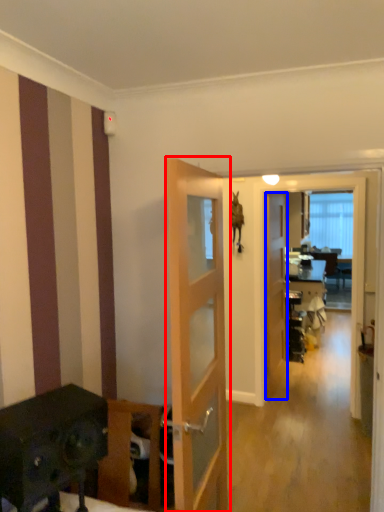
Question: Which object appears closest to the camera in this image, door (highlighted by a red box) or door (highlighted by a blue box)?

Choices:
 (A) door
 (B) door

Answer: (A)